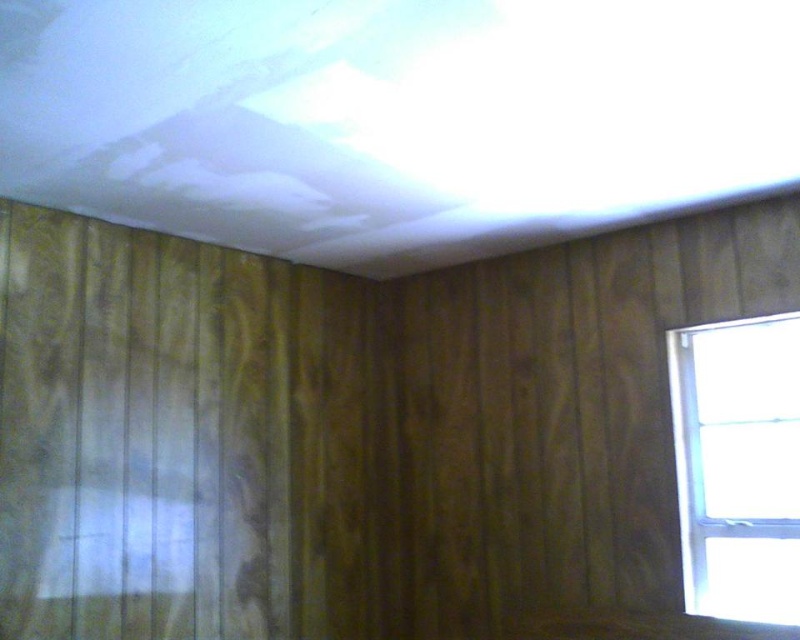
Question: Does wooden paneling at left appear over white plastic window at right?

Choices:
 (A) no
 (B) yes

Answer: (B)

Question: Which object is farther from the camera taking this photo?

Choices:
 (A) white plastic window at right
 (B) wooden paneling at left

Answer: (A)

Question: Which object appears farthest from the camera in this image?

Choices:
 (A) wooden paneling at left
 (B) white plastic window at right

Answer: (B)

Question: Does wooden paneling at left have a larger size compared to white plastic window at right?

Choices:
 (A) yes
 (B) no

Answer: (A)

Question: Does wooden paneling at left have a larger size compared to white plastic window at right?

Choices:
 (A) no
 (B) yes

Answer: (B)